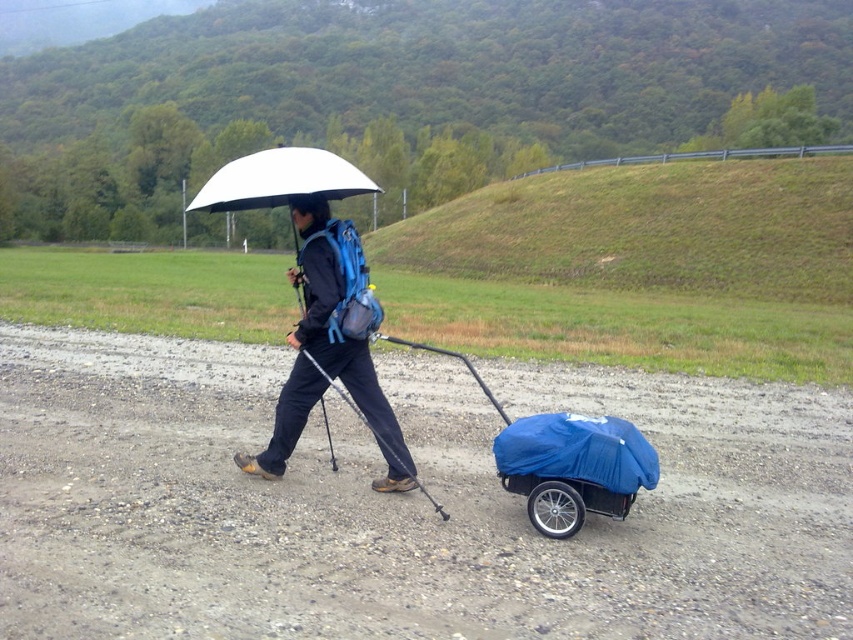
You are a hiker trying to take a photo of the blue fabric cart at center and the white matte umbrella at upper center. Which object should you focus on first if you want to capture both in the same frame without moving your camera? Explain your reasoning based on their positions.

You should focus on the white matte umbrella at upper center first because the blue fabric cart at center is to the right of it. By centering the umbrella in your frame, you can adjust the camera to include the cart on the right side without needing to reposition yourself.

The person is carrying a blue fabric cart at center and wearing a matte black jacket at center. Which object is taller?

The matte black jacket at center is taller than the blue fabric cart at center.

You are a hiker trying to decide where to place your camping gear. You have a dirt gravel at center and a matte black jacket at center. Which surface is lower in height?

The dirt gravel at center is not as tall as matte black jacket at center, so the dirt gravel at center is lower in height.